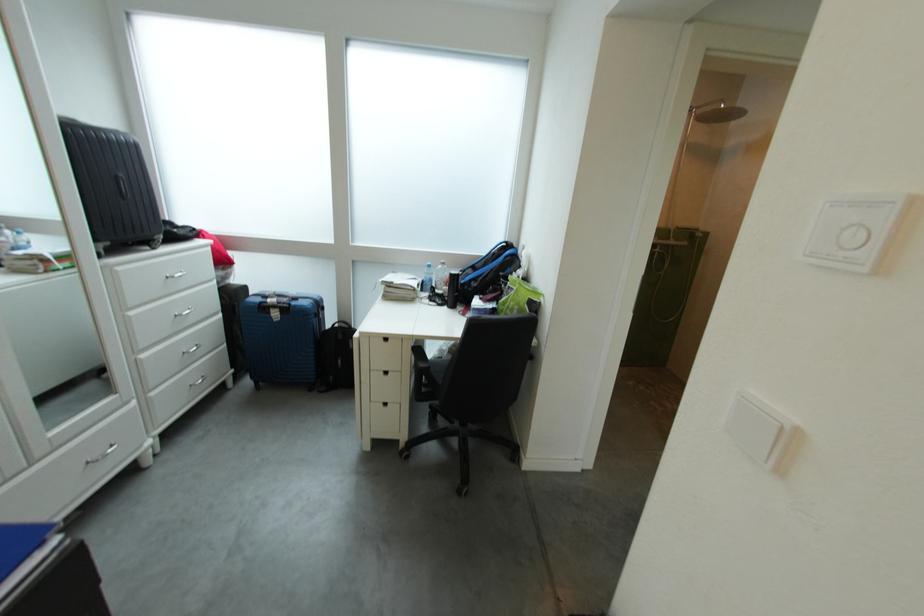
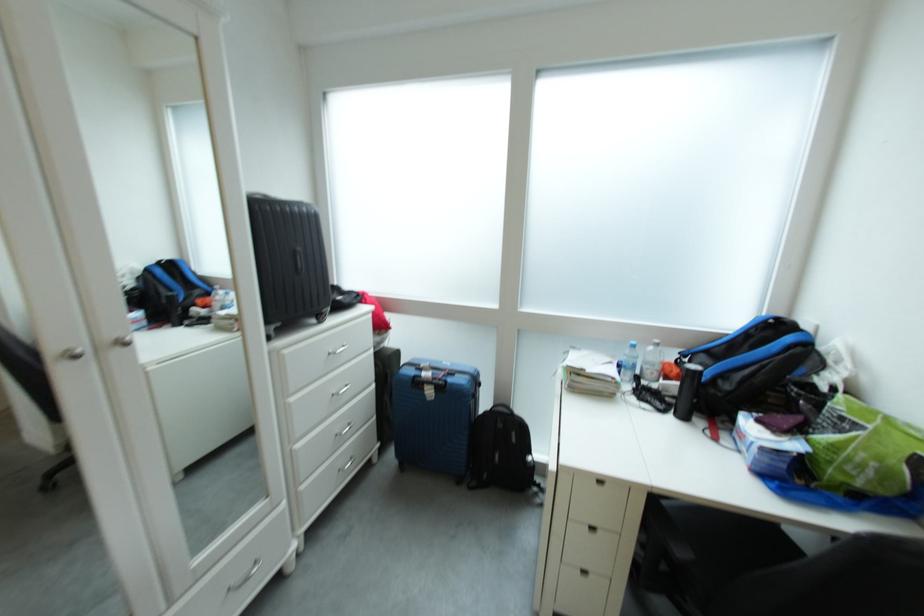
In the second image, find the point that corresponds to (x=485, y=286) in the first image.

(737, 390)